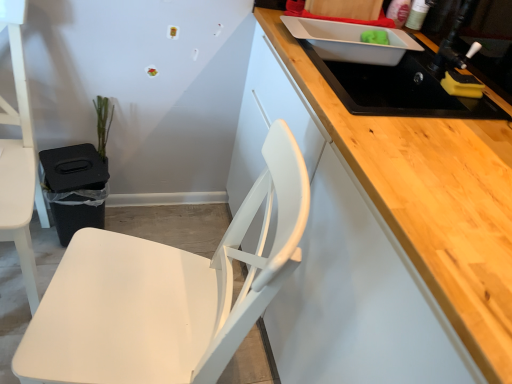
What is the approximate width of white matte chair at left, marked as the 1th chair in a left-to-right arrangement?

It is 22.09 inches.

This screenshot has width=512, height=384. What do you see at coordinates (103, 123) in the screenshot?
I see `green matte plant at left` at bounding box center [103, 123].

This screenshot has height=384, width=512. What do you see at coordinates (398, 88) in the screenshot? I see `black matte sink at upper right` at bounding box center [398, 88].

Find the location of a particular element. The height and width of the screenshot is (384, 512). black matte sink at upper right is located at coordinates (398, 88).

Locate an element on the screen. This screenshot has width=512, height=384. white matte chair at lower left, which appears as the first chair when viewed from the right is located at coordinates (165, 293).

Is green matte plant at left positioned with its back to black matte sink at upper right?

No, green matte plant at left is not facing away from black matte sink at upper right.

Is green matte plant at left at the left side of black matte sink at upper right?

Yes, green matte plant at left is to the left of black matte sink at upper right.

Is point (100, 112) closer or farther from the camera than point (429, 90)?

Point (100, 112) appears to be farther away from the viewer than point (429, 90).

From the image's perspective, which one is positioned higher, white matte chair at lower left, which appears as the first chair when viewed from the right, or white matte chair at left, marked as the 1th chair in a left-to-right arrangement?

From the image's view, white matte chair at left, marked as the 1th chair in a left-to-right arrangement, is above.

Is white matte chair at lower left, the 2th chair in the left-to-right sequence, facing towards white matte chair at left, marked as the 1th chair in a left-to-right arrangement?

No, white matte chair at lower left, the 2th chair in the left-to-right sequence, does not turn towards white matte chair at left, marked as the 1th chair in a left-to-right arrangement.

Is white matte chair at lower left, which appears as the first chair when viewed from the right, shorter than white matte chair at left, marked as the 1th chair in a left-to-right arrangement?

Indeed, white matte chair at lower left, which appears as the first chair when viewed from the right, has a lesser height compared to white matte chair at left, marked as the 1th chair in a left-to-right arrangement.

Are white matte chair at lower left, the 2th chair in the left-to-right sequence, and white matte chair at left, positioned as the second chair in right-to-left order, located far from each other?

No, white matte chair at lower left, the 2th chair in the left-to-right sequence, is not far away from white matte chair at left, positioned as the second chair in right-to-left order.

Is point (293, 185) less distant than point (93, 100)?

Yes, it is.

Would you say white matte chair at lower left, which appears as the first chair when viewed from the right, is to the left or to the right of green matte plant at left in the picture?

white matte chair at lower left, which appears as the first chair when viewed from the right, is positioned on green matte plant at left's right side.

Locate an element on the screen. chair that is the 2nd object above the green matte plant at left (from a real-world perspective) is located at coordinates (165, 293).

Is white matte chair at lower left, the 2th chair in the left-to-right sequence, inside or outside of green matte plant at left?

white matte chair at lower left, the 2th chair in the left-to-right sequence, cannot be found inside green matte plant at left.

Which is more distant, (x=29, y=262) or (x=70, y=259)?

The point (x=29, y=262) is farther from the camera.

Who is more distant, white matte chair at left, positioned as the second chair in right-to-left order, or white matte chair at lower left, which appears as the first chair when viewed from the right?

Positioned behind is white matte chair at left, positioned as the second chair in right-to-left order.

How far apart are white matte chair at left, positioned as the second chair in right-to-left order, and white matte chair at lower left, the 2th chair in the left-to-right sequence?

white matte chair at left, positioned as the second chair in right-to-left order, is 20.88 inches from white matte chair at lower left, the 2th chair in the left-to-right sequence.

From the picture: How different are the orientations of white matte chair at left, positioned as the second chair in right-to-left order, and green matte plant at left in degrees?

The angle between the facing direction of white matte chair at left, positioned as the second chair in right-to-left order, and the facing direction of green matte plant at left is 0.000581 degrees.

Can you confirm if white matte chair at left, positioned as the second chair in right-to-left order, is wider than green matte plant at left?

Indeed, white matte chair at left, positioned as the second chair in right-to-left order, has a greater width compared to green matte plant at left.

Is white matte chair at left, marked as the 1th chair in a left-to-right arrangement, facing towards green matte plant at left?

No.

From a real-world perspective, is white matte chair at left, positioned as the second chair in right-to-left order, on top of green matte plant at left?

Yes, from a real-world perspective, white matte chair at left, positioned as the second chair in right-to-left order, is above green matte plant at left.

Is white matte chair at left, positioned as the second chair in right-to-left order, placed right next to black matte sink at upper right?

No.

From the picture: Which is in front, white matte chair at left, positioned as the second chair in right-to-left order, or black matte sink at upper right?

white matte chair at left, positioned as the second chair in right-to-left order.

From the image's perspective, is white matte chair at left, marked as the 1th chair in a left-to-right arrangement, on top of black matte sink at upper right?

No, from the image's perspective, white matte chair at left, marked as the 1th chair in a left-to-right arrangement, is not on top of black matte sink at upper right.

Is point (361, 45) closer to camera compared to point (109, 125)?

Yes, it is in front of point (109, 125).

What's the angular difference between black matte sink at upper right and green matte plant at left's facing directions?

black matte sink at upper right and green matte plant at left are facing 89.9 degrees away from each other.

At what (x,y) coordinates should I click in order to perform the action: click on plant on the left side of black matte sink at upper right. Please return your answer as a coordinate pair (x, y). The height and width of the screenshot is (384, 512). Looking at the image, I should click on (103, 123).

Which of these two, black matte sink at upper right or green matte plant at left, is bigger?

With larger size is black matte sink at upper right.

Find the location of a particular element. The height and width of the screenshot is (384, 512). plant that is under the black matte sink at upper right (from a real-world perspective) is located at coordinates (103, 123).

Locate an element on the screen. The image size is (512, 384). chair located in front of the white matte chair at left, marked as the 1th chair in a left-to-right arrangement is located at coordinates (165, 293).

Which object lies further to the anchor point white matte chair at lower left, which appears as the first chair when viewed from the right, green matte plant at left or white matte chair at left, marked as the 1th chair in a left-to-right arrangement?

Based on the image, green matte plant at left appears to be further to white matte chair at lower left, which appears as the first chair when viewed from the right.

From the image, which object appears to be farther from green matte plant at left, black matte sink at upper right or white matte chair at left, marked as the 1th chair in a left-to-right arrangement?

Among the two, black matte sink at upper right is located further to green matte plant at left.

Looking at the image, which one is located further to white matte chair at left, marked as the 1th chair in a left-to-right arrangement, black matte sink at upper right or white matte chair at lower left, which appears as the first chair when viewed from the right?

Based on the image, black matte sink at upper right appears to be further to white matte chair at left, marked as the 1th chair in a left-to-right arrangement.

Estimate the real-world distances between objects in this image. Which object is further from white matte chair at left, positioned as the second chair in right-to-left order, green matte plant at left or black matte sink at upper right?

The object further to white matte chair at left, positioned as the second chair in right-to-left order, is black matte sink at upper right.

Based on their spatial positions, is green matte plant at left or white matte chair at lower left, the 2th chair in the left-to-right sequence, closer to black matte sink at upper right?

Based on the image, white matte chair at lower left, the 2th chair in the left-to-right sequence, appears to be nearer to black matte sink at upper right.

Estimate the real-world distances between objects in this image. Which object is further from green matte plant at left, white matte chair at lower left, which appears as the first chair when viewed from the right, or black matte sink at upper right?

Based on the image, black matte sink at upper right appears to be further to green matte plant at left.

Considering their positions, is black matte sink at upper right positioned closer to white matte chair at left, marked as the 1th chair in a left-to-right arrangement, than green matte plant at left?

green matte plant at left is closer to white matte chair at left, marked as the 1th chair in a left-to-right arrangement.

From the image, which object appears to be nearer to green matte plant at left, black matte sink at upper right or white matte chair at lower left, which appears as the first chair when viewed from the right?

white matte chair at lower left, which appears as the first chair when viewed from the right.

You are a GUI agent. You are given a task and a screenshot of the screen. Output one action in this format:
    pyautogui.click(x=<x>, y=<y>)
    Task: Click on the plant located between white matte chair at left, positioned as the second chair in right-to-left order, and black matte sink at upper right in the left-right direction
    Image resolution: width=512 pixels, height=384 pixels.
    Given the screenshot: What is the action you would take?
    pyautogui.click(x=103, y=123)

You are a GUI agent. You are given a task and a screenshot of the screen. Output one action in this format:
    pyautogui.click(x=<x>, y=<y>)
    Task: Click on the chair situated between green matte plant at left and black matte sink at upper right from left to right
    The height and width of the screenshot is (384, 512).
    Given the screenshot: What is the action you would take?
    pyautogui.click(x=165, y=293)

The width and height of the screenshot is (512, 384). In order to click on chair between white matte chair at lower left, which appears as the first chair when viewed from the right, and green matte plant at left in the front-back direction in this screenshot , I will do `click(18, 156)`.

Find the location of a particular element. The height and width of the screenshot is (384, 512). chair between white matte chair at left, marked as the 1th chair in a left-to-right arrangement, and black matte sink at upper right is located at coordinates (165, 293).